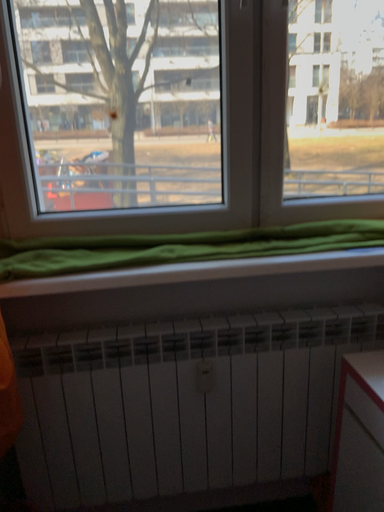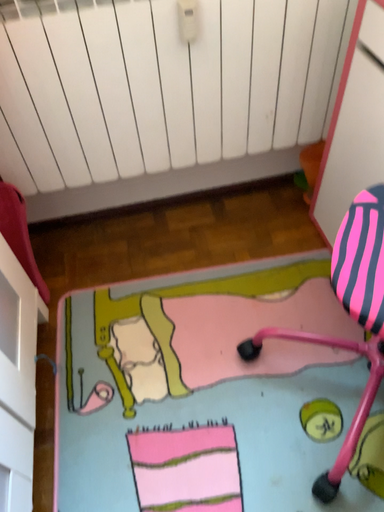
Question: How did the camera likely rotate when shooting the video?

Choices:
 (A) rotated upward
 (B) rotated downward

Answer: (B)